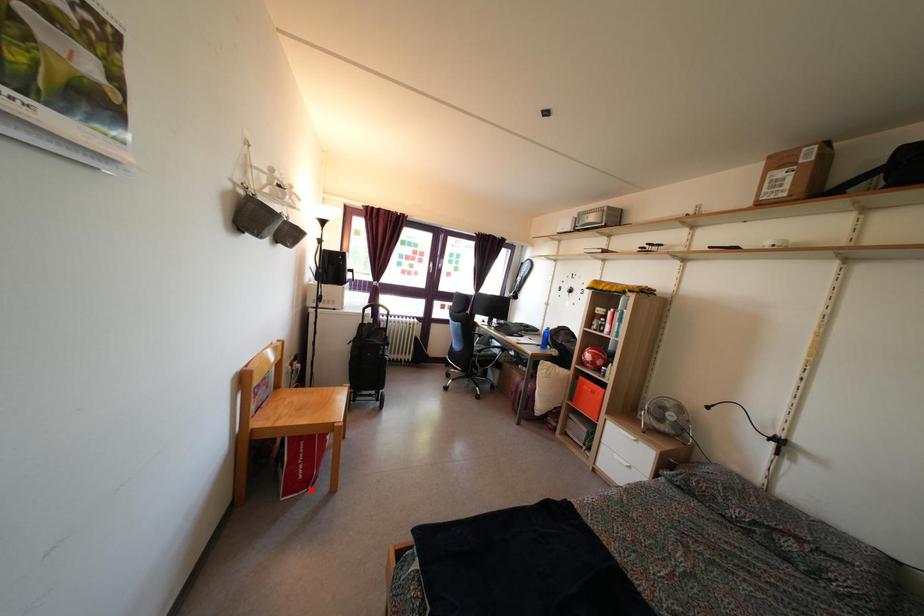
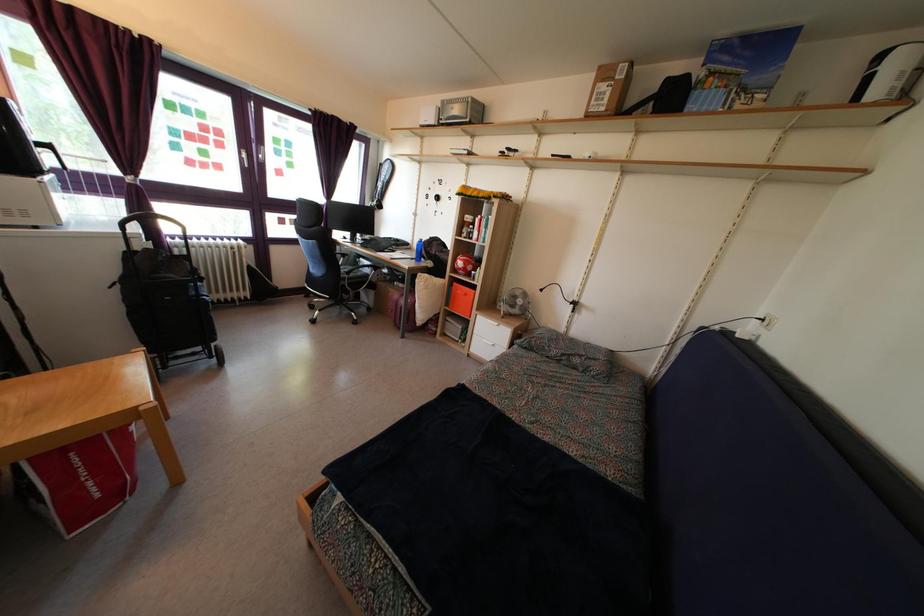
In the second image, find the point that corresponds to the highlighted location in the first image.

(122, 501)